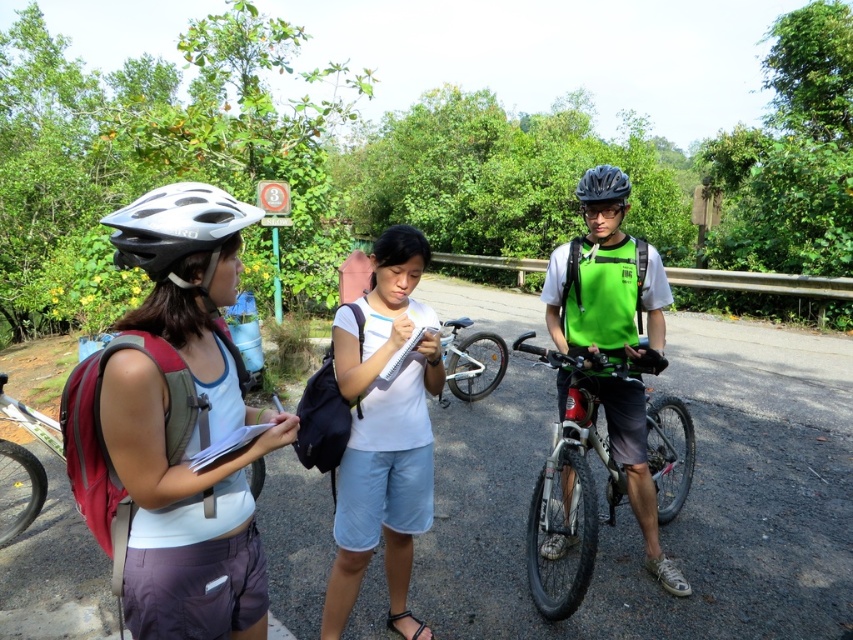
Does white matte bicycle helmet at left appear over black matte helmet at center?

Incorrect, white matte bicycle helmet at left is not positioned above black matte helmet at center.

Between point (204, 230) and point (592, 172), which one is positioned in front?

Point (204, 230)

This screenshot has width=853, height=640. Identify the location of white matte bicycle helmet at left. (177, 230).

The height and width of the screenshot is (640, 853). I want to click on white matte bicycle helmet at left, so click(177, 230).

Can you confirm if white matte helmet at left is thinner than white matte bicycle helmet at left?

In fact, white matte helmet at left might be wider than white matte bicycle helmet at left.

Can you confirm if white matte helmet at left is shorter than white matte bicycle helmet at left?

In fact, white matte helmet at left may be taller than white matte bicycle helmet at left.

Is point (277, 412) farther from camera compared to point (146, 224)?

Yes, point (277, 412) is farther from viewer.

The width and height of the screenshot is (853, 640). In order to click on white matte helmet at left in this screenshot , I will do `click(173, 426)`.

Is point (225, 372) farther from viewer compared to point (453, 369)?

No, it is not.

Is white matte helmet at left bigger than silver metallic bicycle at center?

No.

Is point (119, 576) more distant than point (453, 385)?

No, (119, 576) is closer to viewer.

What are the coordinates of `white matte helmet at left` in the screenshot? It's located at (173, 426).